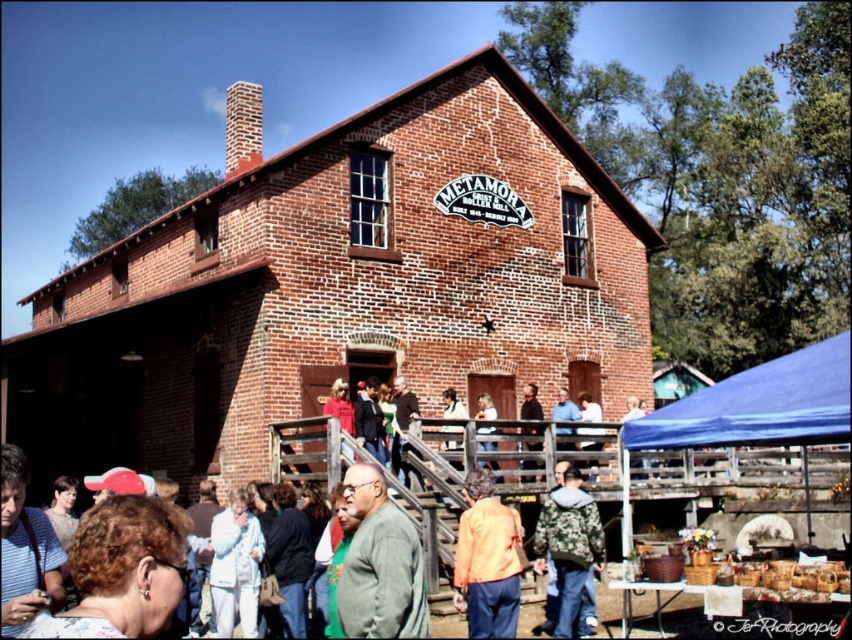
You are a photographer standing at the bottom of the staircase. You want to take a photo of both the green fuzzy sweater at center and the camouflage jacket at lower center in the same frame. Given that your camera has a maximum focus range of 10 meters, will you be able to capture both subjects clearly in one shot?

The distance between the green fuzzy sweater at center and the camouflage jacket at lower center is 9.72 meters, which is within the camera maximum focus range of 10 meters. Therefore, you can capture both subjects clearly in one shot.